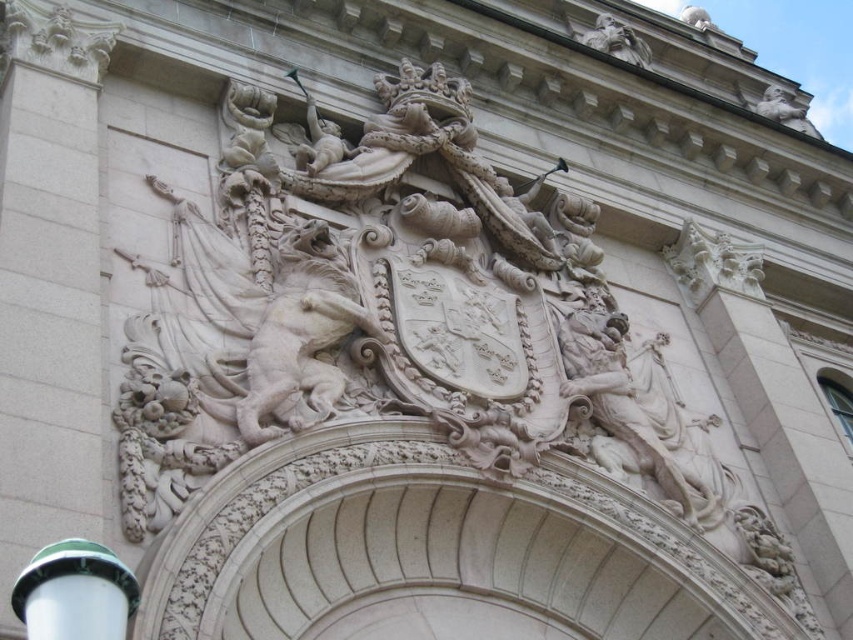
Question: Does white stone coat of arms at center come behind carved stone face at upper center?

Choices:
 (A) yes
 (B) no

Answer: (B)

Question: Estimate the real-world distances between objects in this image. Which object is closer to the carved stone face at upper center?

Choices:
 (A) green plastic lamp post at lower left
 (B) white stone coat of arms at center

Answer: (B)

Question: Among these objects, which one is nearest to the camera?

Choices:
 (A) green plastic lamp post at lower left
 (B) white stone coat of arms at center

Answer: (A)

Question: Is white stone coat of arms at center positioned behind green plastic lamp post at lower left?

Choices:
 (A) yes
 (B) no

Answer: (A)

Question: Which point is closer to the camera?

Choices:
 (A) (59, 595)
 (B) (546, 445)

Answer: (A)

Question: Does white stone coat of arms at center have a greater width compared to carved stone face at upper center?

Choices:
 (A) yes
 (B) no

Answer: (A)